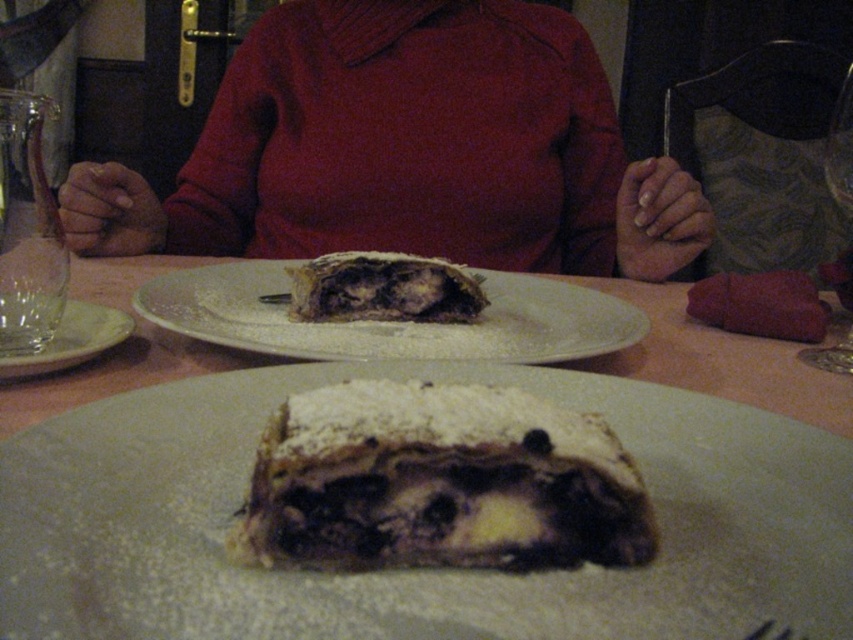
You are planning to place a decorative centerpiece exactly at the center of the table. The table has a coordinate system where the bottom left corner is the origin. The powdered white cake at center is currently at position point 0.892, 0.490. Will the cake interfere with placing the centerpiece at the exact center?

The powdered white cake at center is located at point [416,570], which is very close to the center coordinates of the table. Therefore, placing the centerpiece at the exact center may cause interference with the cake.

You are a guest at this dinner and want to choose the dessert. Which object from the scene is smaller in size between the dusty brown pastry at center and the transparent glass wine glass at lower right?

The dusty brown pastry at center is smaller in size compared to the transparent glass wine glass at lower right.

You are a food critic sitting at the table in the image. You want to describe the powdery white pastry at center and the white ceramic plate at center in your review. Which object is positioned closer to you?

The powdery white pastry at center is closer to the viewer than the white ceramic plate at center.